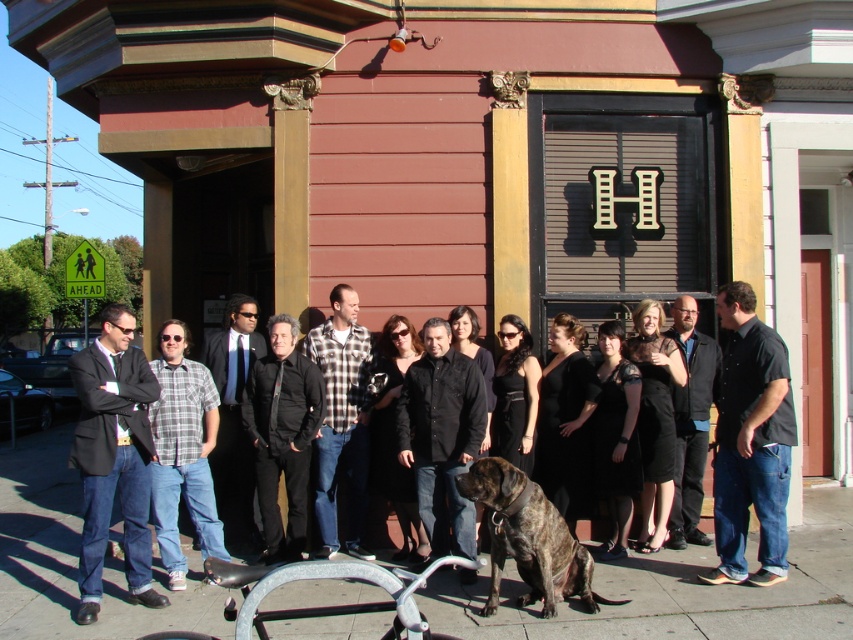
Is black matte shirt at center further to camera compared to brindle fur dog at center?

Yes, it is behind brindle fur dog at center.

Does black matte shirt at center have a smaller size compared to brindle fur dog at center?

No.

Which is behind, point (442, 349) or point (572, 577)?

Point (442, 349)

The width and height of the screenshot is (853, 640). I want to click on black matte shirt at center, so click(440, 436).

Does matte black suit at left have a lesser height compared to plaid flannel shirt at center?

Correct, matte black suit at left is not as tall as plaid flannel shirt at center.

Is point (144, 524) positioned behind point (334, 353)?

That is False.

The width and height of the screenshot is (853, 640). I want to click on matte black suit at left, so click(x=113, y=456).

Looking at this image, which of these two, black shirt at center or black matte shirt at center, stands taller?

black shirt at center

Is black shirt at center behind black matte shirt at center?

No, it is in front of black matte shirt at center.

At what (x,y) coordinates should I click in order to perform the action: click on black shirt at center. Please return your answer as a coordinate pair (x, y). Looking at the image, I should click on (751, 442).

I want to click on black shirt at center, so click(x=751, y=442).